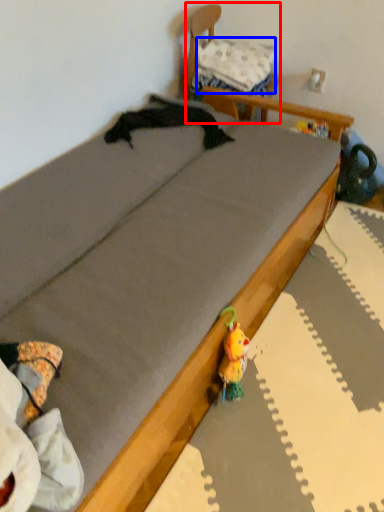
Question: Which of the following is the farthest to the observer, furniture (highlighted by a red box) or pillow (highlighted by a blue box)?

Choices:
 (A) furniture
 (B) pillow

Answer: (B)